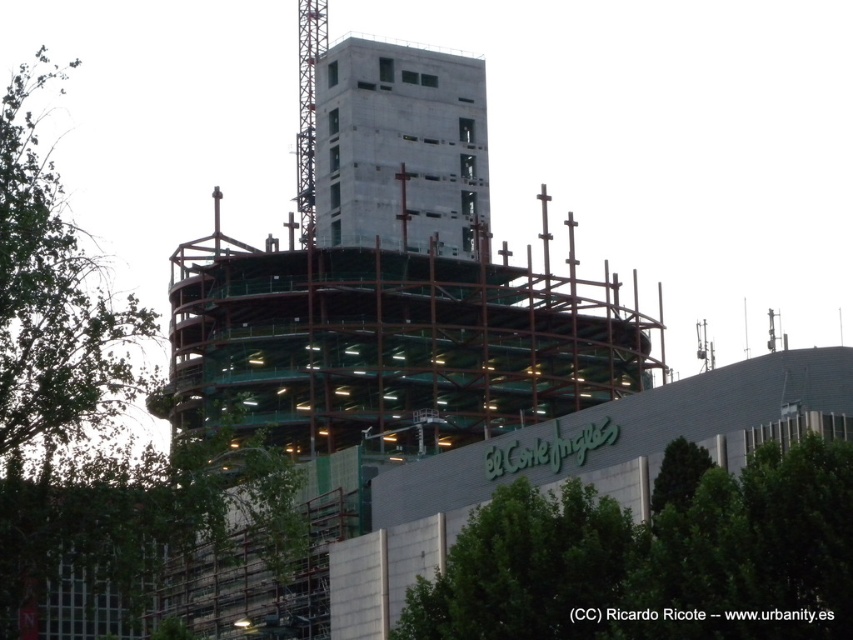
You are standing at the center of the construction site and want to plant a new tree. The construction site manager says the only available spot for the tree is at point (654, 556). Where exactly should you plant the tree?

You should plant the tree at the green leafy tree at lower right, which is located at point (654, 556).

You are a construction worker planning to place a large equipment between the green leafy tree at left and the concrete at center. Based on their widths, which object should you avoid placing the equipment next to to ensure enough space?

The green leafy tree at left might be wider than concrete at center, so you should avoid placing the equipment next to the green leafy tree at left to ensure enough space.